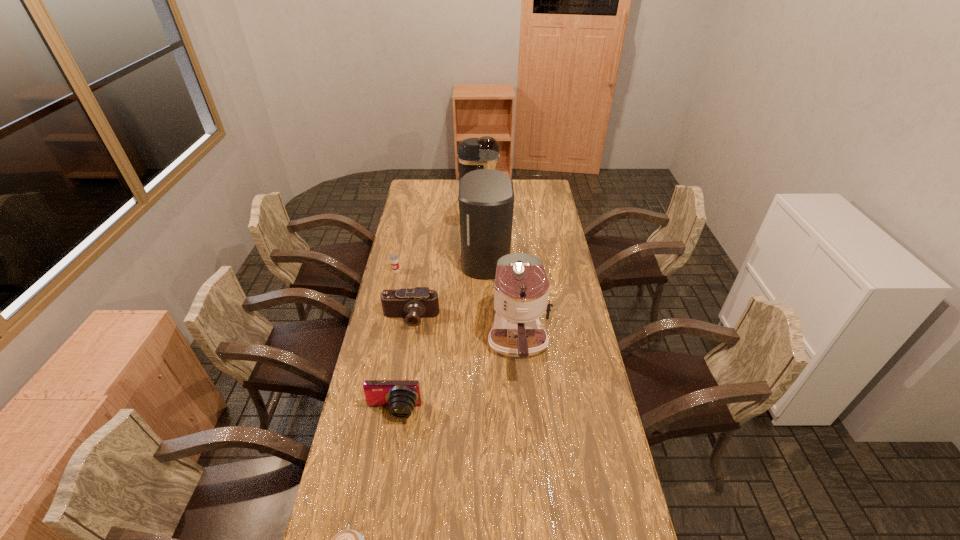
Locate an element on the screen. blank region between the farthest object and the cup is located at coordinates (437, 235).

Where is `empty space that is in between the nearer camera and the nearest coffee maker`? empty space that is in between the nearer camera and the nearest coffee maker is located at coordinates (456, 377).

The width and height of the screenshot is (960, 540). I want to click on vacant area that lies between the second farthest coffee maker and the cup, so [x=441, y=265].

You are a GUI agent. You are given a task and a screenshot of the screen. Output one action in this format:
    pyautogui.click(x=<x>, y=<y>)
    Task: Click on the free spot between the cup and the nearer camera
    
    Given the screenshot: What is the action you would take?
    pyautogui.click(x=395, y=341)

Find the location of a particular element. Image resolution: width=960 pixels, height=540 pixels. blank region between the nearer camera and the nearest coffee maker is located at coordinates (456, 377).

At what (x,y) coordinates should I click in order to perform the action: click on object that ranks as the closest to the farther camera. Please return your answer as a coordinate pair (x, y). The height and width of the screenshot is (540, 960). Looking at the image, I should click on [x=486, y=196].

Identify which object is located as the nearest to the nearer camera. Please provide its 2D coordinates. Your answer should be formatted as a tuple, i.e. [(x, y)], where the tuple contains the x and y coordinates of a point satisfying the conditions above.

[(521, 291)]

Identify the location of coffee maker that is the second closest to the cup. The width and height of the screenshot is (960, 540). (521, 291).

Choose which coffee maker is the nearest neighbor to the shortest object. Please provide its 2D coordinates. Your answer should be formatted as a tuple, i.e. [(x, y)], where the tuple contains the x and y coordinates of a point satisfying the conditions above.

[(521, 291)]

Find the location of a particular element. vacant space that satisfies the following two spatial constraints: 1. place cup under the spout of the farthest object; 2. on the front-facing side of the second nearest object is located at coordinates (477, 411).